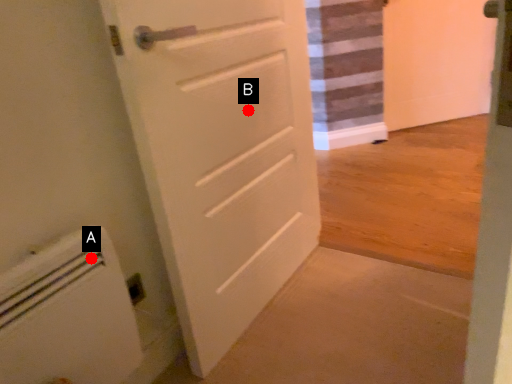
Question: Two points are circled on the image, labeled by A and B beside each circle. Which of the following is the farthest from the observer?

Choices:
 (A) A is further
 (B) B is further

Answer: (B)